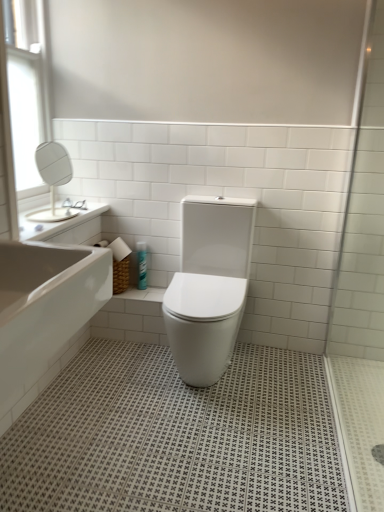
Question: From the image's perspective, does white glossy sink at upper left appear higher than white glossy toilet at center?

Choices:
 (A) yes
 (B) no

Answer: (A)

Question: Considering the relative sizes of white glossy sink at upper left and white glossy toilet at center in the image provided, is white glossy sink at upper left thinner than white glossy toilet at center?

Choices:
 (A) yes
 (B) no

Answer: (A)

Question: Does white glossy sink at upper left have a greater height compared to white glossy toilet at center?

Choices:
 (A) no
 (B) yes

Answer: (A)

Question: Is white glossy sink at upper left wider than white glossy toilet at center?

Choices:
 (A) no
 (B) yes

Answer: (A)

Question: Considering the relative positions of white glossy sink at upper left and white glossy toilet at center in the image provided, is white glossy sink at upper left to the left of white glossy toilet at center from the viewer's perspective?

Choices:
 (A) no
 (B) yes

Answer: (B)

Question: Based on their sizes in the image, would you say white glossy sink at upper left is bigger or smaller than blue glossy spray can at center?

Choices:
 (A) big
 (B) small

Answer: (A)

Question: From their relative heights in the image, would you say white glossy sink at upper left is taller or shorter than blue glossy spray can at center?

Choices:
 (A) short
 (B) tall

Answer: (B)

Question: Is point pyautogui.click(x=74, y=234) closer or farther from the camera than point pyautogui.click(x=139, y=260)?

Choices:
 (A) farther
 (B) closer

Answer: (B)

Question: Considering the positions of white glossy sink at upper left and blue glossy spray can at center in the image, is white glossy sink at upper left wider or thinner than blue glossy spray can at center?

Choices:
 (A) wide
 (B) thin

Answer: (A)

Question: Would you say white glass window at upper left is to the left or to the right of white glossy bathtub at lower left in the picture?

Choices:
 (A) left
 (B) right

Answer: (A)

Question: Is point (36, 139) closer or farther from the camera than point (23, 386)?

Choices:
 (A) farther
 (B) closer

Answer: (A)

Question: From a real-world perspective, is white glass window at upper left positioned above or below white glossy bathtub at lower left?

Choices:
 (A) below
 (B) above

Answer: (B)

Question: Is white glass window at upper left taller or shorter than white glossy bathtub at lower left?

Choices:
 (A) short
 (B) tall

Answer: (B)

Question: Considering the positions of blue glossy spray can at center and transparent glass shower door at right in the image, is blue glossy spray can at center bigger or smaller than transparent glass shower door at right?

Choices:
 (A) big
 (B) small

Answer: (B)

Question: Based on their positions, is blue glossy spray can at center located to the left or right of transparent glass shower door at right?

Choices:
 (A) right
 (B) left

Answer: (B)